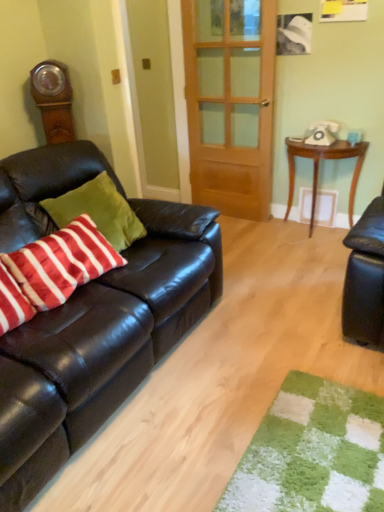
Locate an element on the screen. vacant area located to the right-hand side of matte black couch at left is located at coordinates (270, 352).